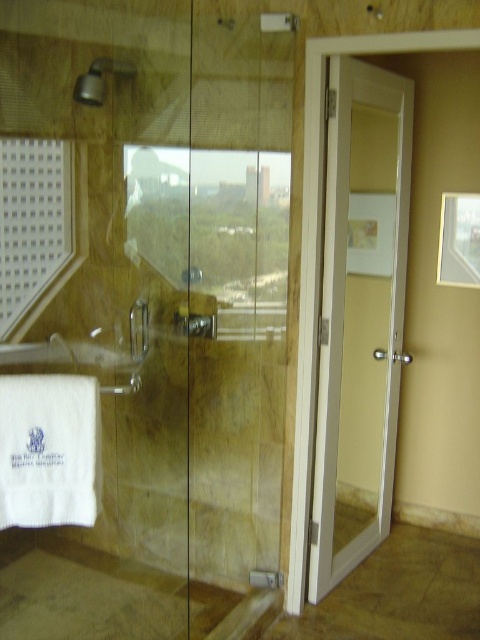
Which is more to the right, white glossy door at right or matte silver showerhead at upper left?

white glossy door at right

Is white glossy door at right taller than matte silver showerhead at upper left?

Correct, white glossy door at right is much taller as matte silver showerhead at upper left.

Between point (331, 253) and point (94, 92), which one is positioned behind?

The point (331, 253) is more distant.

Find the location of a particular element. white glossy door at right is located at coordinates (360, 316).